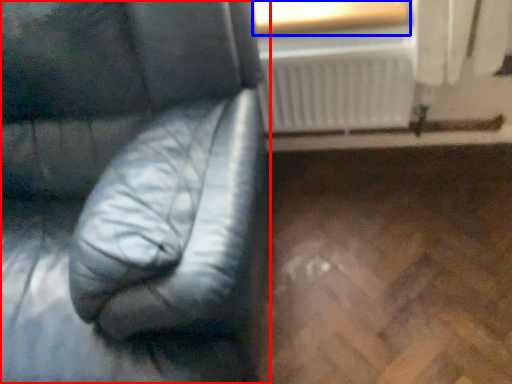
Question: Which point is further to the camera, furniture (highlighted by a red box) or window frame (highlighted by a blue box)?

Choices:
 (A) furniture
 (B) window frame

Answer: (B)